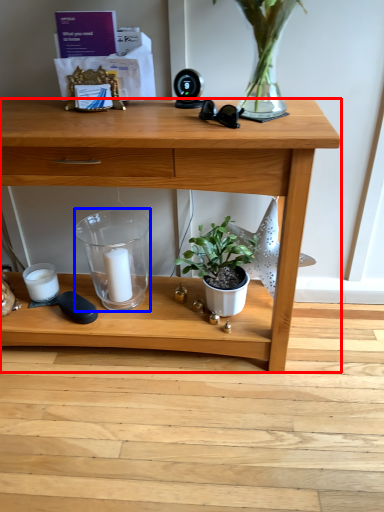
Question: Among these objects, which one is nearest to the camera, desk (highlighted by a red box) or glass vase (highlighted by a blue box)?

Choices:
 (A) desk
 (B) glass vase

Answer: (A)